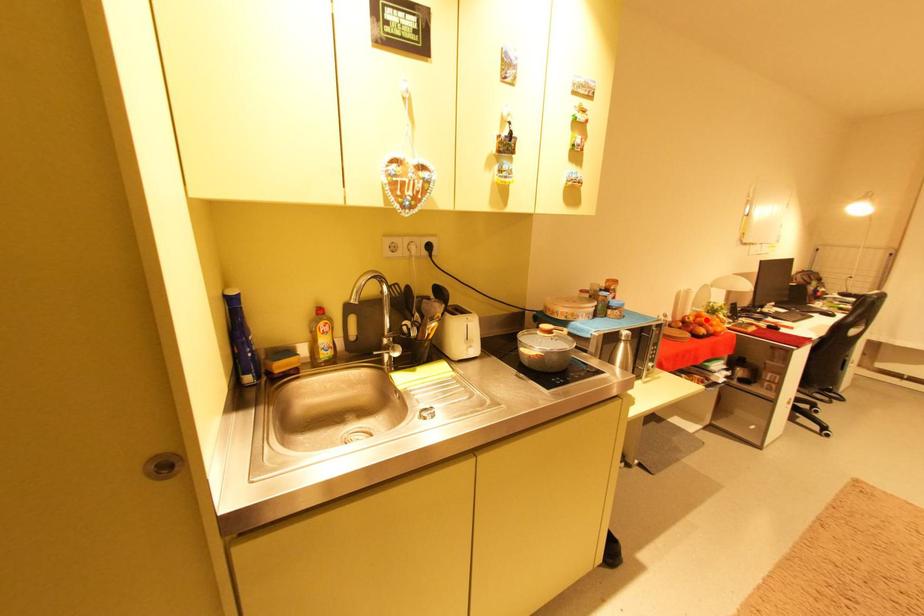
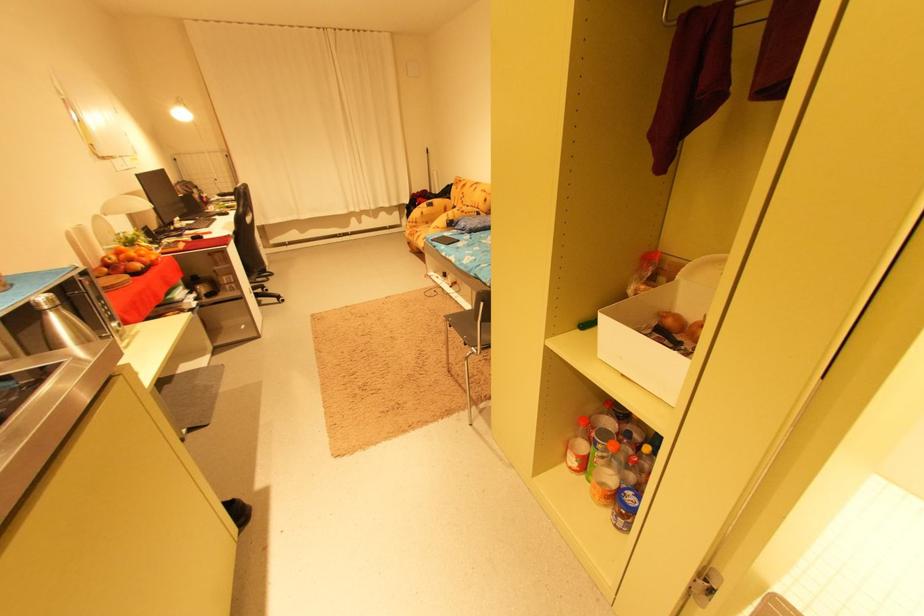
In the second image, find the point that corresponds to the highlighted location in the first image.

(129, 257)